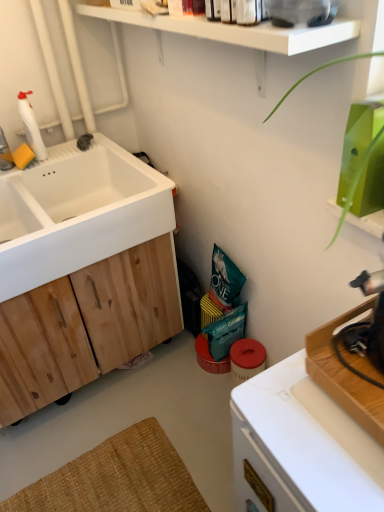
You are a GUI agent. You are given a task and a screenshot of the screen. Output one action in this format:
    pyautogui.click(x=<x>, y=<y>)
    Task: Click on the free spot to the right of white plastic bottle at upper left
    
    Given the screenshot: What is the action you would take?
    pyautogui.click(x=77, y=150)